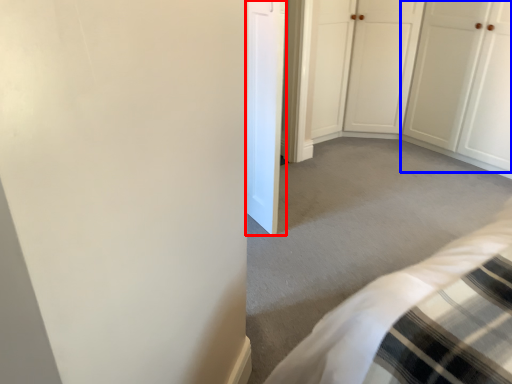
Question: Which object appears closest to the camera in this image, door (highlighted by a red box) or door (highlighted by a blue box)?

Choices:
 (A) door
 (B) door

Answer: (A)